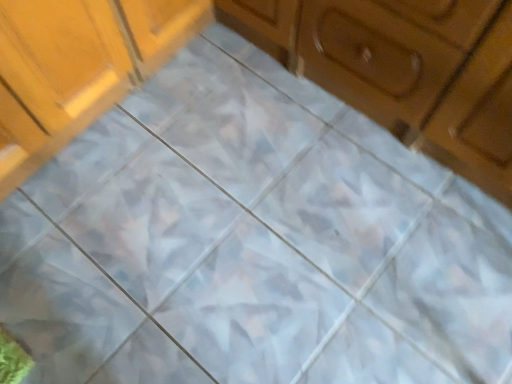
Question: From the image's perspective, is wooden cabinet at upper right, which ranks as the second cabinetry in left-to-right order, above or below matte wood cabinet at upper left, which is counted as the second cabinetry, starting from the right?

Choices:
 (A) above
 (B) below

Answer: (B)

Question: Considering the relative positions of wooden cabinet at upper right, which ranks as the second cabinetry in left-to-right order, and matte wood cabinet at upper left, which is counted as the second cabinetry, starting from the right, in the image provided, is wooden cabinet at upper right, which ranks as the second cabinetry in left-to-right order, to the left or to the right of matte wood cabinet at upper left, which is counted as the second cabinetry, starting from the right,?

Choices:
 (A) right
 (B) left

Answer: (A)

Question: From a real-world perspective, is wooden cabinet at upper right, the first cabinetry positioned from the right, positioned above or below matte wood cabinet at upper left, which is counted as the second cabinetry, starting from the right?

Choices:
 (A) below
 (B) above

Answer: (B)

Question: Is matte wood cabinet at upper left, placed as the first cabinetry when sorted from left to right, spatially inside wooden cabinet at upper right, which ranks as the second cabinetry in left-to-right order, or outside of it?

Choices:
 (A) inside
 (B) outside

Answer: (B)

Question: Considering the positions of point 92,18 and point 507,147, is point 92,18 closer or farther from the camera than point 507,147?

Choices:
 (A) closer
 (B) farther

Answer: (B)

Question: From the image's perspective, is matte wood cabinet at upper left, placed as the first cabinetry when sorted from left to right, located above or below wooden cabinet at upper right, which ranks as the second cabinetry in left-to-right order?

Choices:
 (A) above
 (B) below

Answer: (A)

Question: In terms of width, does matte wood cabinet at upper left, placed as the first cabinetry when sorted from left to right, look wider or thinner when compared to wooden cabinet at upper right, which ranks as the second cabinetry in left-to-right order?

Choices:
 (A) thin
 (B) wide

Answer: (B)